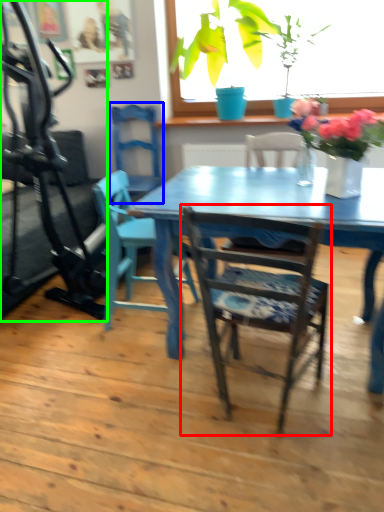
Question: Which object is positioned closest to chair (highlighted by a red box)? Select from chair (highlighted by a blue box) and treadmill (highlighted by a green box).

Choices:
 (A) chair
 (B) treadmill

Answer: (B)